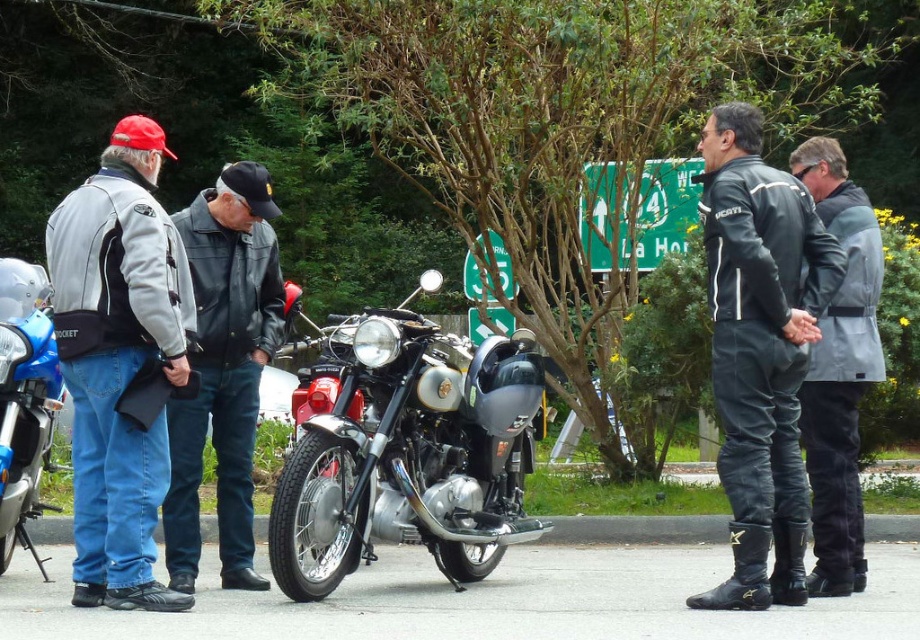
Question: Which of the following is the farthest from the observer?

Choices:
 (A) click(x=400, y=328)
 (B) click(x=240, y=500)
 (C) click(x=30, y=372)

Answer: (B)

Question: Is black leather jacket at right bigger than shiny blue motorcycle at left?

Choices:
 (A) no
 (B) yes

Answer: (A)

Question: Is shiny chrome motorcycle at center positioned at the back of matte black jacket at left?

Choices:
 (A) no
 (B) yes

Answer: (B)

Question: Based on their relative distances, which object is nearer to the matte black jacket at left?

Choices:
 (A) shiny blue motorcycle at left
 (B) shiny chrome motorcycle at center
 (C) black leather jacket at left
 (D) gray fabric jacket at center

Answer: (C)

Question: Among these objects, which one is nearest to the camera?

Choices:
 (A) shiny chrome motorcycle at center
 (B) matte black jacket at left

Answer: (B)

Question: Does shiny chrome motorcycle at center have a greater width compared to gray fabric jacket at center?

Choices:
 (A) no
 (B) yes

Answer: (B)